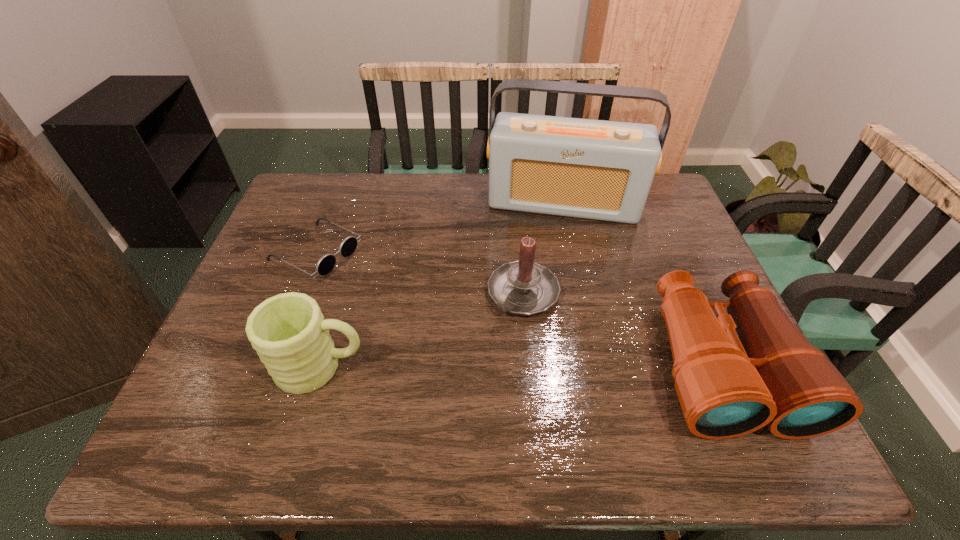
At what (x,y) coordinates should I click in order to perform the action: click on mug. Please return your answer as a coordinate pair (x, y). The height and width of the screenshot is (540, 960). Looking at the image, I should click on (288, 331).

I want to click on binoculars, so click(x=728, y=386).

Identify the location of the shortest object. The width and height of the screenshot is (960, 540). (327, 262).

Locate an element on the screen. Image resolution: width=960 pixels, height=540 pixels. radio receiver is located at coordinates (602, 170).

Find the location of `candle`. candle is located at coordinates (524, 287).

In order to click on blank area located on the side of the mug with the handle in this screenshot , I will do `click(521, 367)`.

I want to click on vacant space located 0.280m on the front-facing side of the sunglasses, so click(434, 312).

I want to click on free space located on the front-facing side of the sunglasses, so click(x=412, y=300).

What are the coordinates of `blank space located 0.370m on the front-facing side of the sunglasses` in the screenshot? It's located at (465, 327).

The height and width of the screenshot is (540, 960). In order to click on free spot located on the front-facing side of the tallest object in this screenshot , I will do [548, 273].